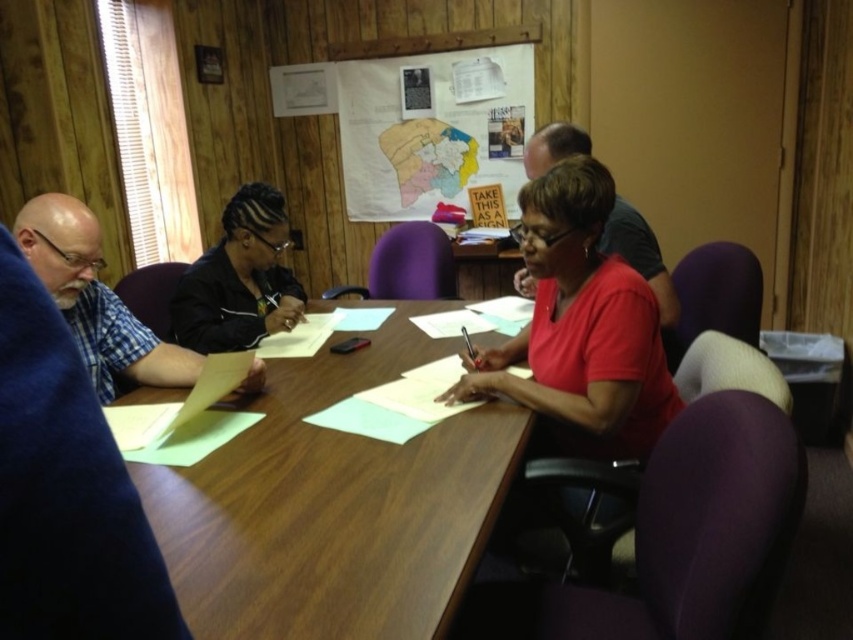
You are organizing a meeting in this room and need to ensure that the paper map at upper center is visible to everyone around the table. Given that the matte black shirt at upper center is covering part of the map, will the map still be mostly visible to the people seated around the table?

The paper map at upper center is wider than the matte black shirt at upper center, so even if the shirt is covering part of it, the majority of the map should still be visible to others around the table.

You are a photographer setting up for a group photo in this meeting room. You want to ensure both the black matte jacket at center and the matte black shirt at upper center are clearly visible in the frame. Based on their positions, which one should you focus on first to ensure proper focus?

The black matte jacket at center should be focused on first because it is positioned below the matte black shirt at upper center, meaning it is closer to the camera. Focusing on the closer object first ensures that both will be in focus if using a shallow depth of field.

You are organizing a photo shoot and need to ensure that the black matte jacket at center and the matte black shirt at upper center are visible in the frame. Given their sizes, which one might require a closer camera focus to capture details?

The black matte jacket at center has a smaller size compared to matte black shirt at upper center, so it might require a closer camera focus to capture details.